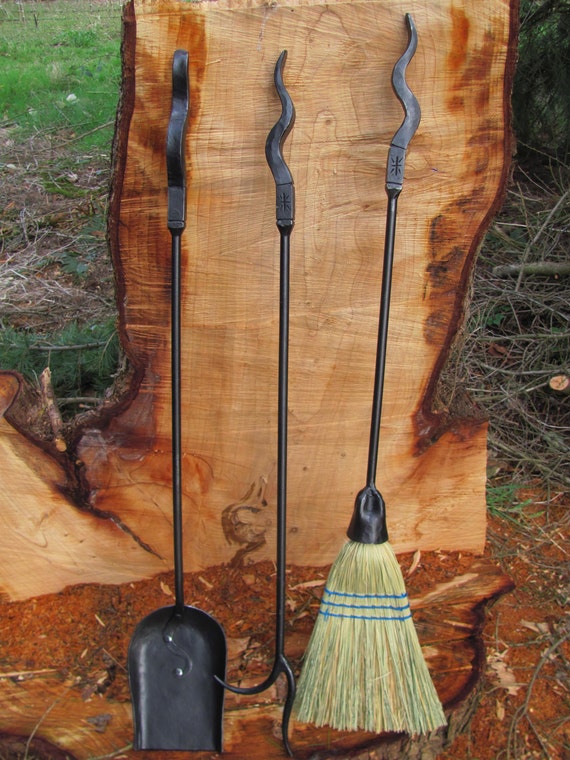
Identify the location of curvy handles. (268, 143), (175, 156), (403, 74).